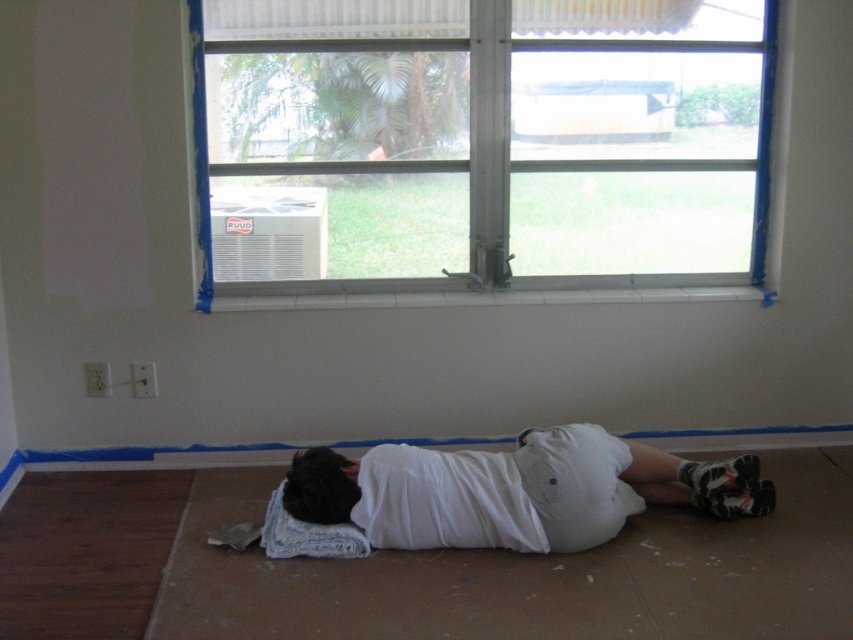
Question: Is clear glass window at center wider than white cotton shirt at lower center?

Choices:
 (A) yes
 (B) no

Answer: (A)

Question: Can you confirm if clear glass window at center is positioned to the right of white cotton shirt at lower center?

Choices:
 (A) yes
 (B) no

Answer: (B)

Question: Which object is positioned farthest from the white cotton shirt at lower center?

Choices:
 (A) black fuzzy head at center
 (B) clear glass window at center

Answer: (B)

Question: Which object is closer to the camera taking this photo?

Choices:
 (A) black fuzzy head at center
 (B) white cotton shirt at lower center

Answer: (A)

Question: Among these points, which one is farthest from the camera?

Choices:
 (A) (503, 45)
 (B) (492, 461)

Answer: (A)

Question: Observing the image, what is the correct spatial positioning of clear glass window at center in reference to white cotton shirt at lower center?

Choices:
 (A) below
 (B) above

Answer: (B)